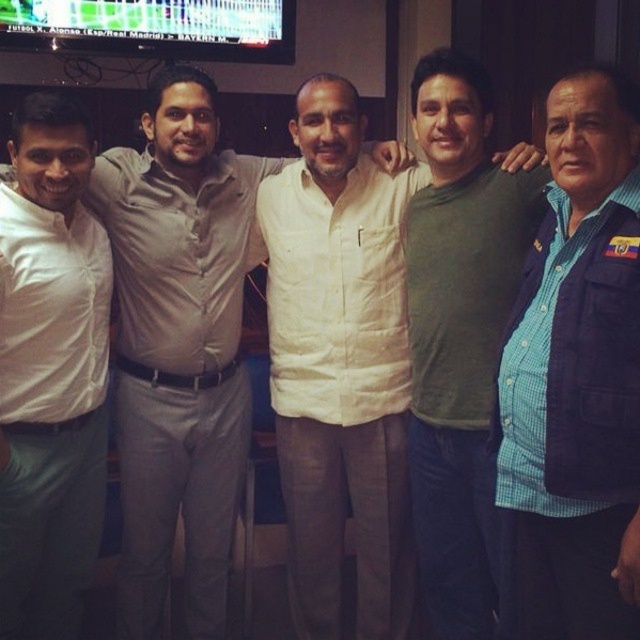
You are standing in the room where the five men are posing. You want to greet the man wearing the white shirt at center. Which direction should you move to approach him?

The white shirt at center is located at point [179,344], so you should move towards the center of the group to reach him.

Looking at this image, you are standing in front of the group of men and want to reach both the point at coordinates (401, 147) and the point at coordinates (40, 310). Which point should you move toward first to reach the closer one?

You should move toward point (401, 147) first because it is closer to you than point (40, 310).

You are a photographer adjusting the camera height to ensure all subjects are in focus. Given that the white shirt at center is much taller than the white matte shirt at left, which subject should you position closer to the camera to maintain balance in the composition?

You should position the white matte shirt at left closer to the camera because it is shorter than the white shirt at center, helping to balance the composition by compensating for the height difference.